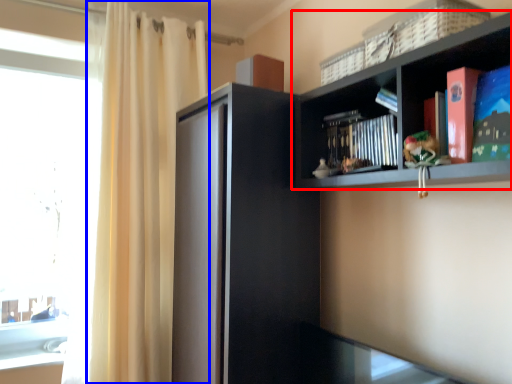
Question: Which point is closer to the camera, shelf (highlighted by a red box) or curtain (highlighted by a blue box)?

Choices:
 (A) shelf
 (B) curtain

Answer: (A)